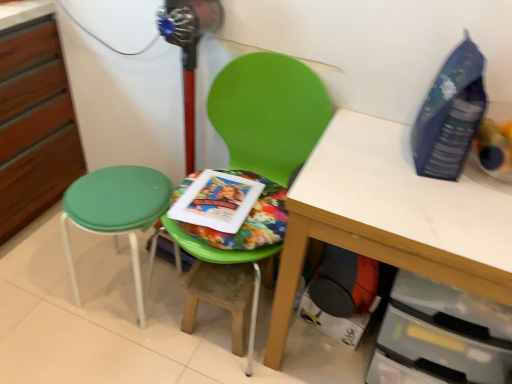
Image resolution: width=512 pixels, height=384 pixels. What are the coordinates of `free space in front of blue plastic bottle at upper right` in the screenshot? It's located at (442, 203).